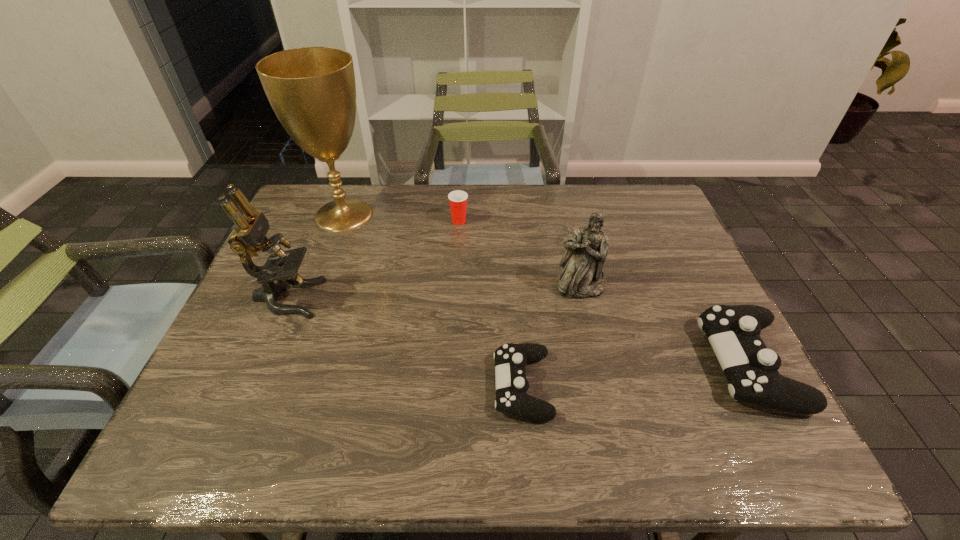
The height and width of the screenshot is (540, 960). Find the location of `the left control`. the left control is located at coordinates (510, 359).

Locate an element on the screen. The image size is (960, 540). the shortest object is located at coordinates (510, 359).

At what (x,y) coordinates should I click in order to perform the action: click on the right control. Please return your answer as a coordinate pair (x, y). Looking at the image, I should click on (751, 369).

Where is `the taller control`? The height and width of the screenshot is (540, 960). the taller control is located at coordinates (751, 369).

Where is `the tallest object`? the tallest object is located at coordinates (312, 90).

Locate an element on the screen. Image resolution: width=960 pixels, height=540 pixels. the third object from left to right is located at coordinates (458, 199).

Image resolution: width=960 pixels, height=540 pixels. Find the location of `figurine`. figurine is located at coordinates (582, 277).

Identify the location of the second object from right to left. (582, 277).

At what (x,y) coordinates should I click in order to perform the action: click on microscope. Please return your answer as a coordinate pair (x, y). Looking at the image, I should click on (249, 237).

What are the coordinates of `free space located 0.150m on the surface of the shorter control` in the screenshot? It's located at (423, 386).